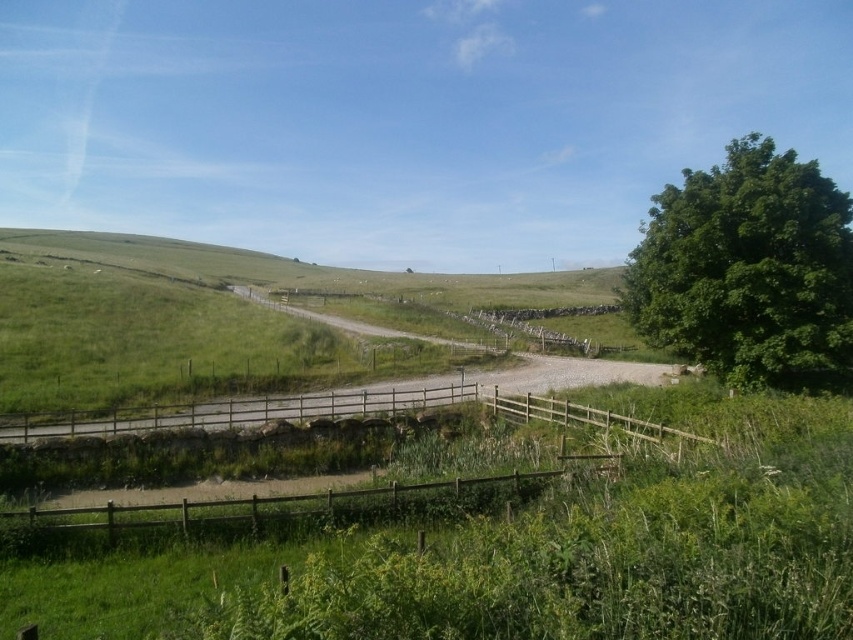
Question: Does green grassy hillside at center appear on the left side of green leafy tree at right?

Choices:
 (A) no
 (B) yes

Answer: (B)

Question: Is green grassy hillside at center below green leafy tree at right?

Choices:
 (A) yes
 (B) no

Answer: (B)

Question: Among these objects, which one is farthest from the camera?

Choices:
 (A) green grassy hillside at center
 (B) brown wooden fence at lower center
 (C) green leafy tree at right

Answer: (A)

Question: Which point is farther from the camera taking this photo?

Choices:
 (A) (822, 337)
 (B) (433, 353)
 (C) (241, 515)

Answer: (B)

Question: Does green grassy hillside at center have a lesser width compared to green leafy tree at right?

Choices:
 (A) no
 (B) yes

Answer: (A)

Question: Which point is closer to the camera taking this photo?

Choices:
 (A) (189, 509)
 (B) (772, 356)
 (C) (202, 259)

Answer: (A)